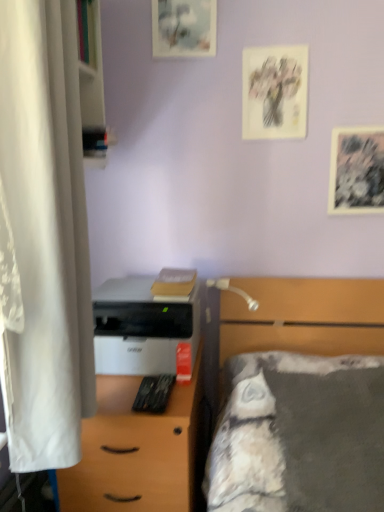
Measure the distance between point (379, 200) and camera.

They are 5.55 feet apart.

What do you see at coordinates (43, 238) in the screenshot?
I see `white fabric curtain at left` at bounding box center [43, 238].

Where is `white matte desk at center`? This screenshot has width=384, height=512. white matte desk at center is located at coordinates (136, 450).

What do you see at coordinates (184, 28) in the screenshot? I see `matte paper picture frame at upper center, marked as the first picture frame in a left-to-right arrangement` at bounding box center [184, 28].

At what (x,y) coordinates should I click in order to perform the action: click on white matte printer at center. Please return your answer as a coordinate pair (x, y). This screenshot has width=384, height=512. Looking at the image, I should click on (141, 327).

The height and width of the screenshot is (512, 384). What do you see at coordinates (141, 327) in the screenshot? I see `white matte printer at center` at bounding box center [141, 327].

Identify the location of black textured paper at upper right, which appears as the 1th picture frame when viewed from the right. (356, 170).

Is black textured paper at upper right, placed as the third picture frame when sorted from top to bottom, facing away from white matte printer at center?

No, black textured paper at upper right, placed as the third picture frame when sorted from top to bottom,'s orientation is not away from white matte printer at center.

From the picture: Is black textured paper at upper right, placed as the third picture frame when sorted from top to bottom, completely or partially outside of white matte printer at center?

Yes, black textured paper at upper right, placed as the third picture frame when sorted from top to bottom, is outside of white matte printer at center.

Considering the sizes of black textured paper at upper right, the third picture frame in the left-to-right sequence, and white matte printer at center in the image, is black textured paper at upper right, the third picture frame in the left-to-right sequence, taller or shorter than white matte printer at center?

In the image, black textured paper at upper right, the third picture frame in the left-to-right sequence, appears to be taller than white matte printer at center.

From the image's perspective, is black textured paper at upper right, which appears as the 1th picture frame when viewed from the right, located beneath white matte printer at center?

Incorrect, from the image's perspective, black textured paper at upper right, which appears as the 1th picture frame when viewed from the right, is higher than white matte printer at center.

Is white wood bookshelf at left behind black textured paper at upper right, the first picture frame when ordered from bottom to top?

That is False.

Which is correct: white wood bookshelf at left is inside black textured paper at upper right, the first picture frame when ordered from bottom to top, or outside of it?

white wood bookshelf at left cannot be found inside black textured paper at upper right, the first picture frame when ordered from bottom to top.

Consider the image. Is the surface of white wood bookshelf at left in direct contact with black textured paper at upper right, the first picture frame when ordered from bottom to top?

No, white wood bookshelf at left is not next to black textured paper at upper right, the first picture frame when ordered from bottom to top.

How different are the orientations of white wood bookshelf at left and black textured paper at upper right, the first picture frame when ordered from bottom to top, in degrees?

The facing directions of white wood bookshelf at left and black textured paper at upper right, the first picture frame when ordered from bottom to top, are 90 degrees apart.

How distant is matte paper picture frame at upper right, positioned as the second picture frame in bottom-to-top order, from white matte desk at center?

They are 3.73 feet apart.

Between matte paper picture frame at upper right, placed as the 2th picture frame when sorted from left to right, and white matte desk at center, which one has more height?

Standing taller between the two is white matte desk at center.

Is matte paper picture frame at upper right, positioned as the second picture frame in bottom-to-top order, not near white matte desk at center?

Yes, matte paper picture frame at upper right, positioned as the second picture frame in bottom-to-top order, is far from white matte desk at center.

The width and height of the screenshot is (384, 512). What are the coordinates of `desk on the left of matte paper picture frame at upper right, the second picture frame from the top` in the screenshot? It's located at (136, 450).

From a real-world perspective, between white matte desk at center and matte paper picture frame at upper right, positioned as the second picture frame in bottom-to-top order, who is vertically higher?

From a 3D spatial view, matte paper picture frame at upper right, positioned as the second picture frame in bottom-to-top order, is above.

Between white matte desk at center and matte paper picture frame at upper right, which appears as the second picture frame when viewed from the right, which one has smaller width?

matte paper picture frame at upper right, which appears as the second picture frame when viewed from the right, is thinner.

Is white matte desk at center closer to camera compared to matte paper picture frame at upper right, which appears as the second picture frame when viewed from the right?

Yes.

From the image's perspective, is white matte desk at center under matte paper picture frame at upper right, placed as the 2th picture frame when sorted from left to right?

Correct, white matte desk at center appears lower than matte paper picture frame at upper right, placed as the 2th picture frame when sorted from left to right, in the image.

Can you confirm if white matte desk at center is shorter than white wood bookshelf at left?

In fact, white matte desk at center may be taller than white wood bookshelf at left.

Is white matte desk at center spatially inside white wood bookshelf at left, or outside of it?

The correct answer is: outside.

Is white matte desk at center next to white wood bookshelf at left?

No, white matte desk at center is not beside white wood bookshelf at left.

From a real-world perspective, is white matte desk at center physically below white wood bookshelf at left?

Yes, from a real-world perspective, white matte desk at center is beneath white wood bookshelf at left.

Considering the relative sizes of matte paper picture frame at upper center, positioned as the 1th picture frame in top-to-bottom order, and black textured paper at upper right, placed as the third picture frame when sorted from top to bottom, in the image provided, is matte paper picture frame at upper center, positioned as the 1th picture frame in top-to-bottom order, smaller than black textured paper at upper right, placed as the third picture frame when sorted from top to bottom,?

Actually, matte paper picture frame at upper center, positioned as the 1th picture frame in top-to-bottom order, might be larger than black textured paper at upper right, placed as the third picture frame when sorted from top to bottom.

How much distance is there between matte paper picture frame at upper center, positioned as the 1th picture frame in top-to-bottom order, and black textured paper at upper right, placed as the third picture frame when sorted from top to bottom?

A distance of 28.34 inches exists between matte paper picture frame at upper center, positioned as the 1th picture frame in top-to-bottom order, and black textured paper at upper right, placed as the third picture frame when sorted from top to bottom.

In terms of height, does matte paper picture frame at upper center, marked as the first picture frame in a left-to-right arrangement, look taller or shorter compared to black textured paper at upper right, the third picture frame in the left-to-right sequence?

Considering their sizes, matte paper picture frame at upper center, marked as the first picture frame in a left-to-right arrangement, has more height than black textured paper at upper right, the third picture frame in the left-to-right sequence.

Is matte paper picture frame at upper center, the third picture frame ordered from the bottom, situated inside black textured paper at upper right, the first picture frame when ordered from bottom to top, or outside?

matte paper picture frame at upper center, the third picture frame ordered from the bottom, cannot be found inside black textured paper at upper right, the first picture frame when ordered from bottom to top.

Is gray fabric bed at right situated inside matte paper picture frame at upper center, marked as the third picture frame in a right-to-left arrangement, or outside?

gray fabric bed at right is not enclosed by matte paper picture frame at upper center, marked as the third picture frame in a right-to-left arrangement.

Considering the relative sizes of gray fabric bed at right and matte paper picture frame at upper center, marked as the third picture frame in a right-to-left arrangement, in the image provided, is gray fabric bed at right shorter than matte paper picture frame at upper center, marked as the third picture frame in a right-to-left arrangement,?

Incorrect, the height of gray fabric bed at right does not fall short of that of matte paper picture frame at upper center, marked as the third picture frame in a right-to-left arrangement.

How different are the orientations of gray fabric bed at right and matte paper picture frame at upper center, marked as the first picture frame in a left-to-right arrangement, in degrees?

The angle between the facing direction of gray fabric bed at right and the facing direction of matte paper picture frame at upper center, marked as the first picture frame in a left-to-right arrangement, is 0.00657 degrees.

From the image's perspective, would you say gray fabric bed at right is shown under matte paper picture frame at upper center, marked as the first picture frame in a left-to-right arrangement?

Yes, from the image's perspective, gray fabric bed at right is beneath matte paper picture frame at upper center, marked as the first picture frame in a left-to-right arrangement.

Where is `printer lying below the black textured paper at upper right, which appears as the 1th picture frame when viewed from the right (from the image's perspective)`? The image size is (384, 512). printer lying below the black textured paper at upper right, which appears as the 1th picture frame when viewed from the right (from the image's perspective) is located at coordinates (141, 327).

In order to click on bookshelf above the black textured paper at upper right, the third picture frame in the left-to-right sequence (from the image's perspective) in this screenshot , I will do `click(87, 74)`.

Which object lies further to the anchor point black textured paper at upper right, the first picture frame when ordered from bottom to top, white fabric curtain at left or white matte desk at center?

white fabric curtain at left.

From the image, which object appears to be nearer to matte paper picture frame at upper center, marked as the first picture frame in a left-to-right arrangement, white matte desk at center or white wood bookshelf at left?

The object closer to matte paper picture frame at upper center, marked as the first picture frame in a left-to-right arrangement, is white wood bookshelf at left.

Considering their positions, is white matte printer at center positioned closer to matte paper picture frame at upper center, marked as the third picture frame in a right-to-left arrangement, than black textured paper at upper right, the third picture frame in the left-to-right sequence?

black textured paper at upper right, the third picture frame in the left-to-right sequence, is positioned closer to the anchor matte paper picture frame at upper center, marked as the third picture frame in a right-to-left arrangement.

Looking at this image, which object lies further to the anchor point matte paper picture frame at upper right, positioned as the second picture frame in bottom-to-top order, matte paper picture frame at upper center, marked as the first picture frame in a left-to-right arrangement, or white wood bookshelf at left?

The object further to matte paper picture frame at upper right, positioned as the second picture frame in bottom-to-top order, is white wood bookshelf at left.

Considering their positions, is white fabric curtain at left positioned further to white matte desk at center than matte paper picture frame at upper right, positioned as the second picture frame in bottom-to-top order?

matte paper picture frame at upper right, positioned as the second picture frame in bottom-to-top order, is further to white matte desk at center.

From the image, which object appears to be nearer to white fabric curtain at left, matte paper picture frame at upper center, positioned as the 1th picture frame in top-to-bottom order, or white matte printer at center?

white matte printer at center is positioned closer to the anchor white fabric curtain at left.

When comparing their distances from black textured paper at upper right, placed as the third picture frame when sorted from top to bottom, does gray fabric bed at right or matte paper picture frame at upper right, placed as the 2th picture frame when sorted from left to right, seem further?

gray fabric bed at right lies further to black textured paper at upper right, placed as the third picture frame when sorted from top to bottom, than the other object.

Based on the photo, which object lies further to the anchor point gray fabric bed at right, black textured paper at upper right, the third picture frame in the left-to-right sequence, or matte paper picture frame at upper right, the second picture frame from the top?

Among the two, matte paper picture frame at upper right, the second picture frame from the top, is located further to gray fabric bed at right.

Image resolution: width=384 pixels, height=512 pixels. I want to click on printer that lies between matte paper picture frame at upper right, the second picture frame from the top, and white matte desk at center from top to bottom, so click(141, 327).

Find the location of `curtain between matte paper picture frame at upper center, positioned as the 1th picture frame in top-to-bottom order, and gray fabric bed at right from top to bottom`. curtain between matte paper picture frame at upper center, positioned as the 1th picture frame in top-to-bottom order, and gray fabric bed at right from top to bottom is located at coordinates (43, 238).

You are a GUI agent. You are given a task and a screenshot of the screen. Output one action in this format:
    pyautogui.click(x=<x>, y=<y>)
    Task: Click on the printer between white fabric curtain at left and white matte desk at center from top to bottom
    
    Given the screenshot: What is the action you would take?
    pyautogui.click(x=141, y=327)

The image size is (384, 512). I want to click on bed between white fabric curtain at left and black textured paper at upper right, which appears as the 1th picture frame when viewed from the right, from left to right, so click(x=302, y=316).